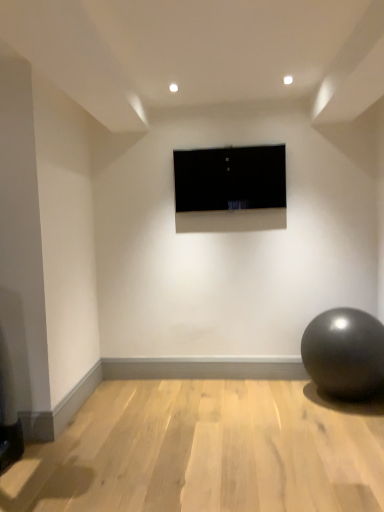
Find the location of a particular element. This screenshot has height=512, width=384. vacant area on top of black glossy tv at center (from a real-world perspective) is located at coordinates (233, 143).